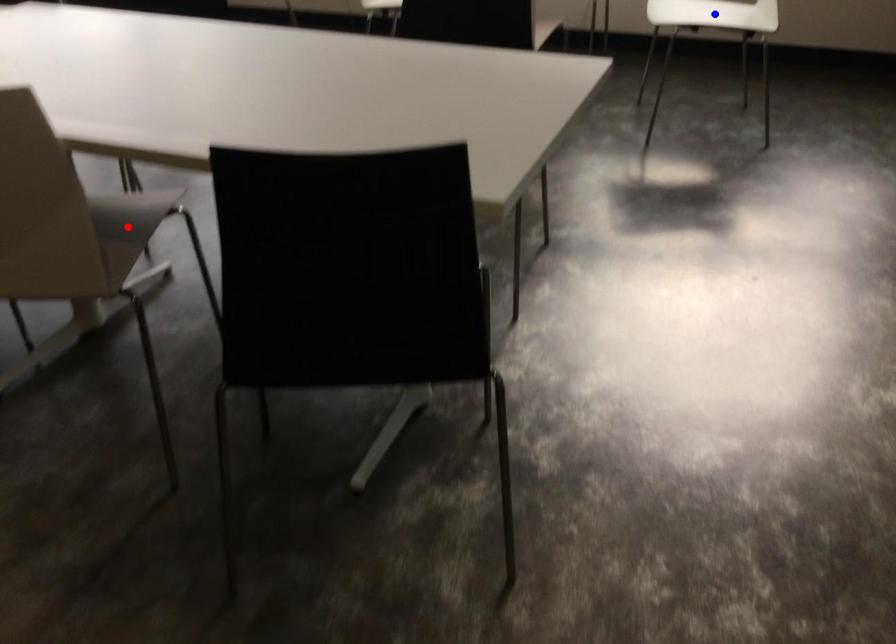
Question: In the image, two points are highlighted. Which point is nearer to the camera? Reply with the corresponding letter.

Choices:
 (A) blue point
 (B) red point

Answer: (B)